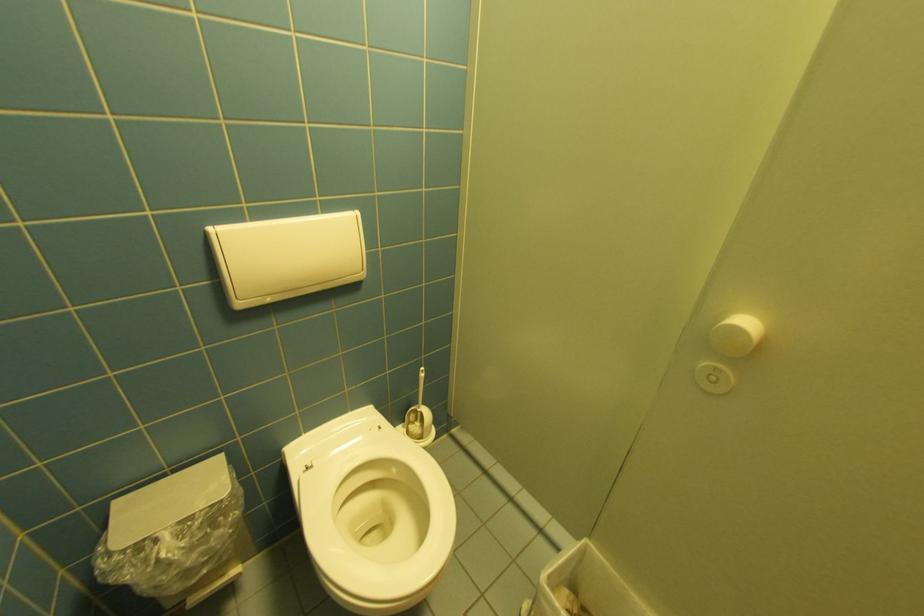
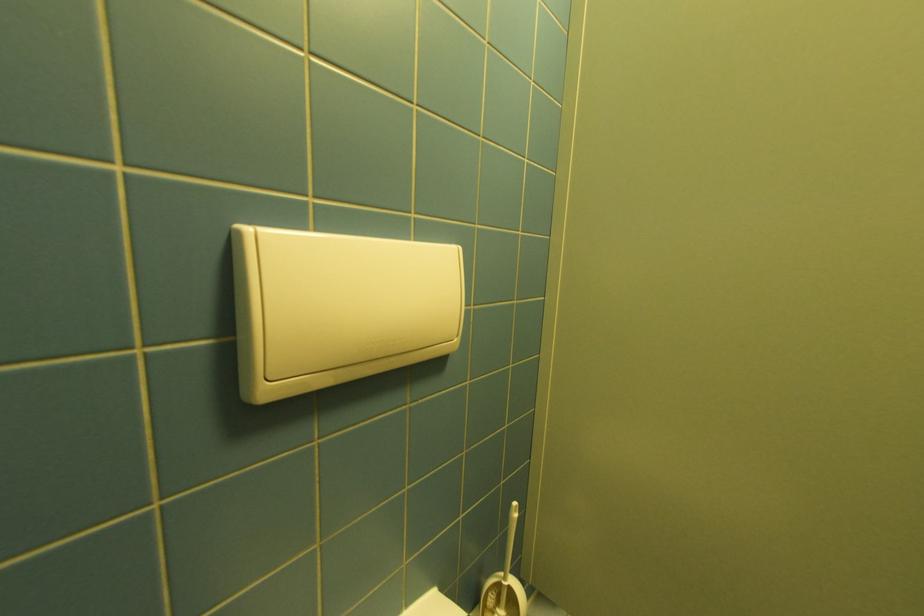
Question: Based on the continuous images, in which direction is the camera rotating? Reply with the corresponding letter.

Choices:
 (A) Left
 (B) Right
 (C) Up
 (D) Down

Answer: (C)